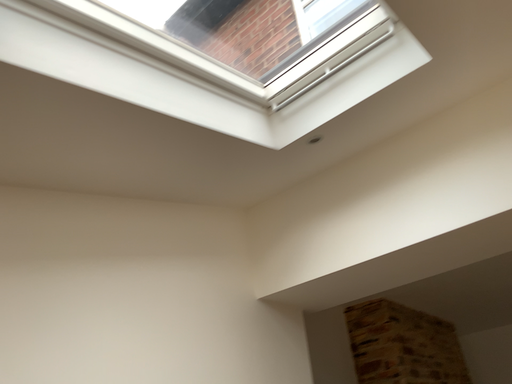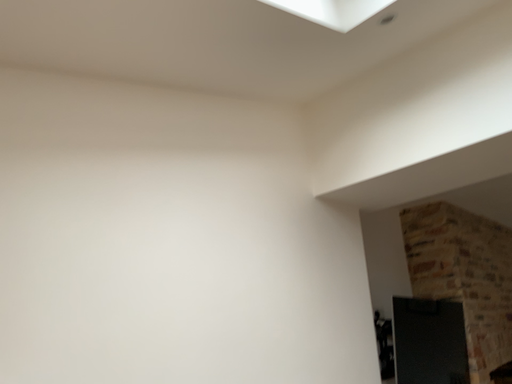
Question: How did the camera likely rotate when shooting the video?

Choices:
 (A) rotated right
 (B) rotated left

Answer: (B)